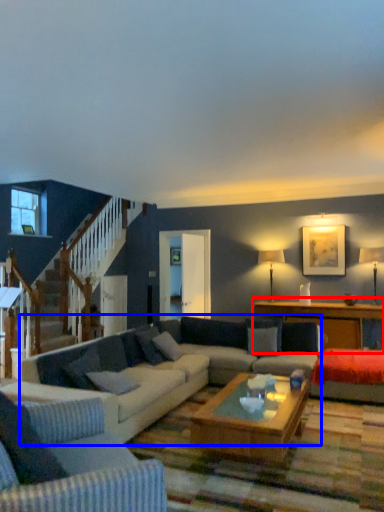
Question: Which of the following is the farthest to the observer, table (highlighted by a red box) or studio couch (highlighted by a blue box)?

Choices:
 (A) table
 (B) studio couch

Answer: (A)